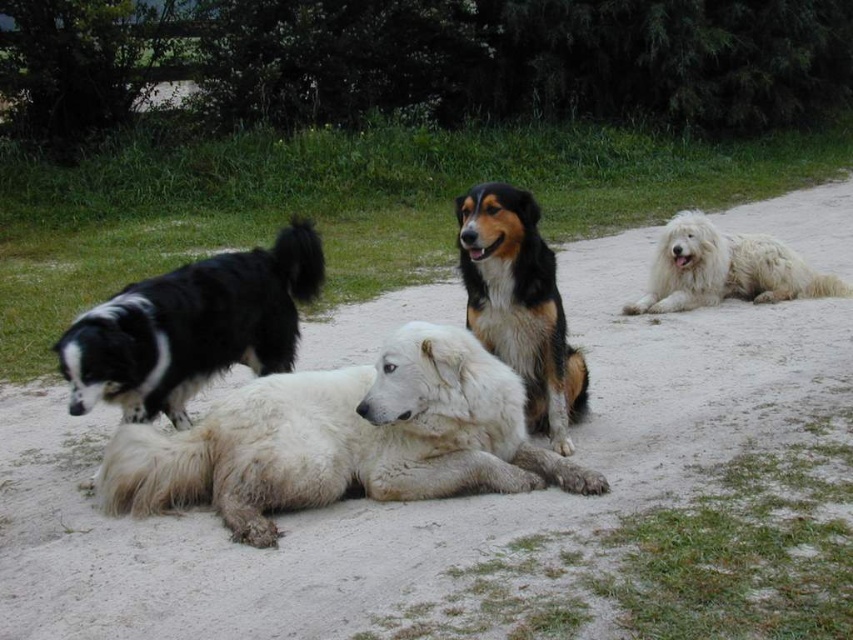
Question: Is white sandy path at center behind tri-colored fur dog at center?

Choices:
 (A) no
 (B) yes

Answer: (B)

Question: Which point is farther from the camera taking this photo?

Choices:
 (A) (383, 481)
 (B) (630, 314)
 (C) (202, 268)
 (D) (142, 582)

Answer: (B)

Question: Which point is farther from the camera taking this photo?

Choices:
 (A) (236, 513)
 (B) (253, 369)

Answer: (B)

Question: Is white fluffy dog at center to the left of white fluffy dog at right from the viewer's perspective?

Choices:
 (A) no
 (B) yes

Answer: (B)

Question: Which point is farther from the camera taking this photo?

Choices:
 (A) (837, 280)
 (B) (593, 474)

Answer: (A)

Question: Is white sandy path at center below white fluffy dog at right?

Choices:
 (A) no
 (B) yes

Answer: (B)